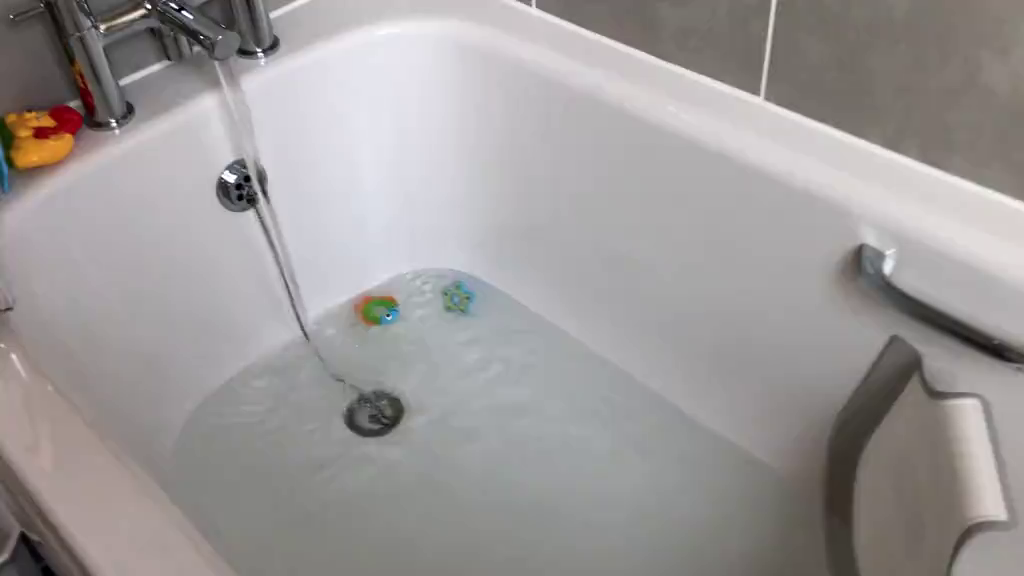
Image resolution: width=1024 pixels, height=576 pixels. In order to click on white tile filler in this screenshot , I will do `click(769, 31)`.